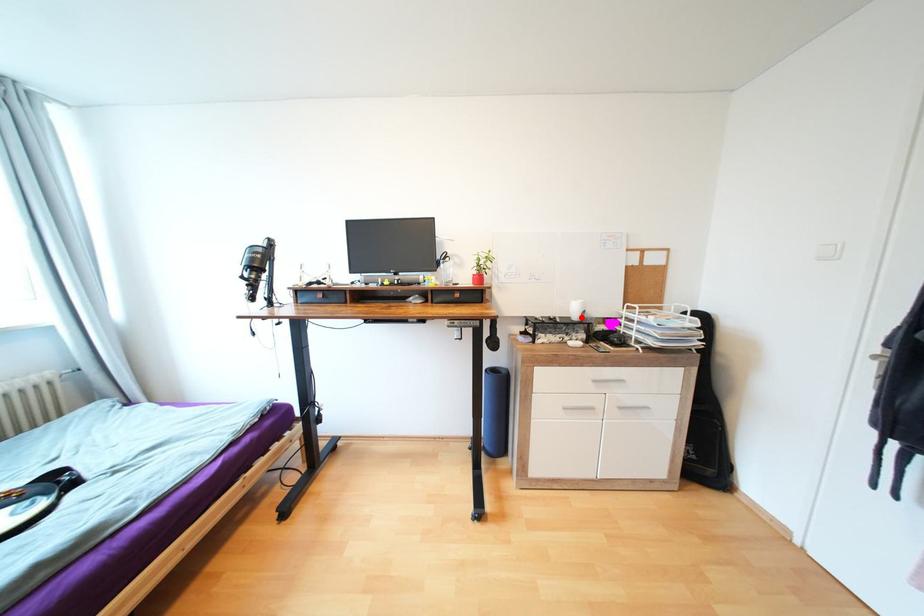
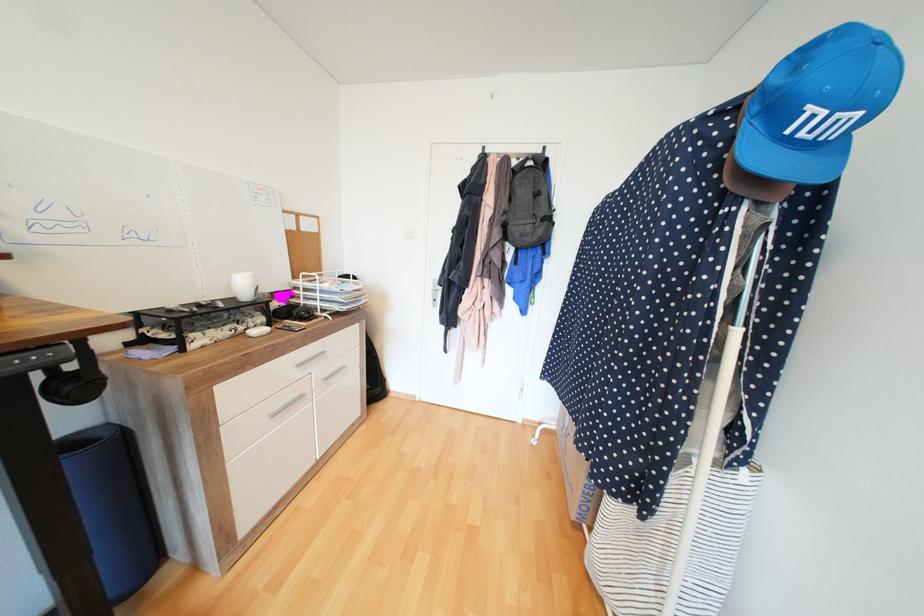
The point at the highlighted location is marked in the first image. Where is the corresponding point in the second image?

(251, 296)